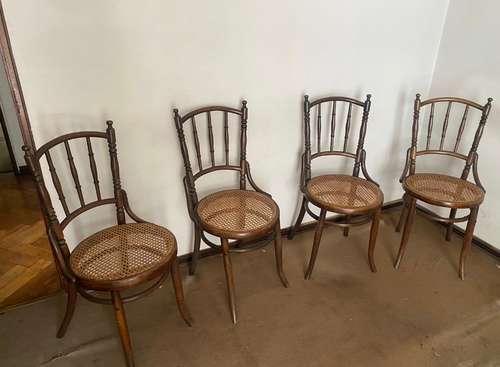
Locate an element on the screen. This screenshot has width=500, height=367. chair seat is located at coordinates (123, 264), (258, 212), (359, 192), (454, 185).